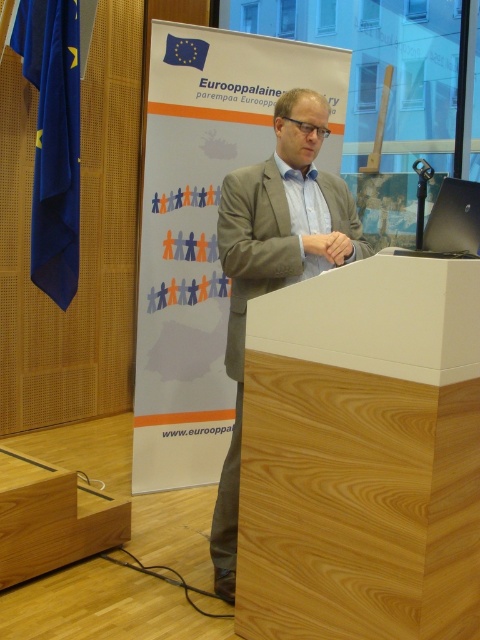
Between light brown suit at center and wooden podium at lower left, which one appears on the right side from the viewer's perspective?

light brown suit at center is more to the right.

Is point (251, 198) behind point (36, 518)?

No, it is not.

Locate an element on the screen. Image resolution: width=480 pixels, height=640 pixels. light brown suit at center is located at coordinates (275, 262).

At what (x,y) coordinates should I click in order to perform the action: click on light brown wood podium at center. Please return your answer as a coordinate pair (x, y). The height and width of the screenshot is (640, 480). Looking at the image, I should click on (362, 456).

Find the location of `light brown wood podium at center`. light brown wood podium at center is located at coordinates (362, 456).

Find the location of a particular element. light brown wood podium at center is located at coordinates (362, 456).

Is light brown wood podium at center to the left of wooden podium at lower left from the viewer's perspective?

Incorrect, light brown wood podium at center is not on the left side of wooden podium at lower left.

Can you confirm if light brown wood podium at center is positioned to the right of wooden podium at lower left?

Yes, light brown wood podium at center is to the right of wooden podium at lower left.

Between point (364, 545) and point (43, 513), which one is positioned behind?

The point (43, 513) is more distant.

I want to click on light brown wood podium at center, so click(x=362, y=456).